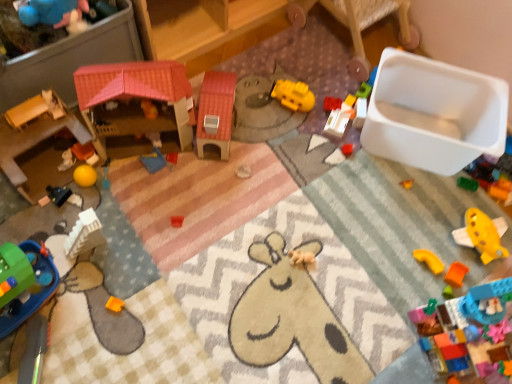
What are the coordinates of `vacant space to the left of bright red plastic blocks at center, which ranks as the ninth toy in left-to-right order` in the screenshot? It's located at (282, 109).